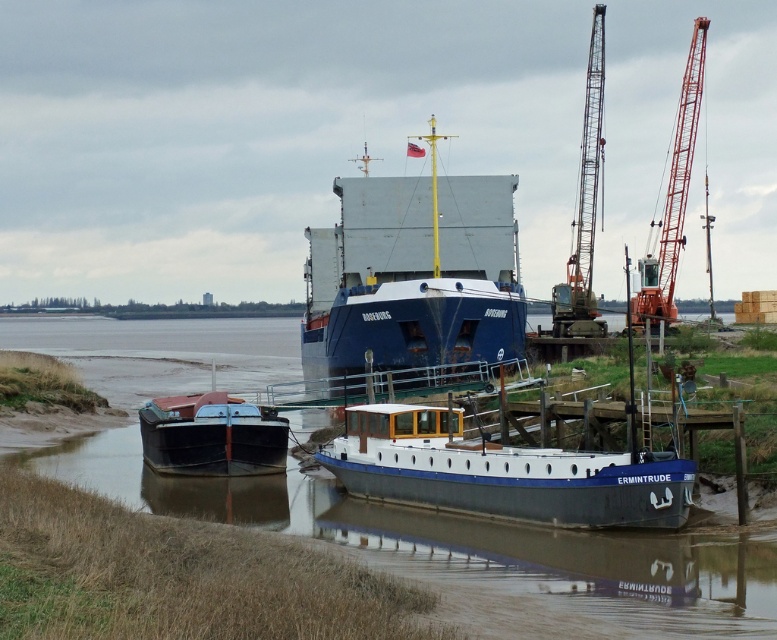
Question: Which object appears closest to the camera in this image?

Choices:
 (A) matte black boat at lower left
 (B) white glossy boat at center
 (C) metallic gray crane at upper right
 (D) blue matte cargo ship at center

Answer: (B)

Question: Is blue matte cargo ship at center below orange metallic crane at upper right?

Choices:
 (A) no
 (B) yes

Answer: (B)

Question: Is white glossy boat at center behind matte black boat at lower left?

Choices:
 (A) yes
 (B) no

Answer: (B)

Question: Which point appears farthest from the camera in this image?

Choices:
 (A) (364, 236)
 (B) (577, 292)
 (C) (431, 461)
 (D) (507, 582)

Answer: (B)

Question: Is smooth mud at boat center to the left of white glossy boat at center from the viewer's perspective?

Choices:
 (A) yes
 (B) no

Answer: (A)

Question: Which of the following is the closest to the observer?

Choices:
 (A) blue matte cargo ship at center
 (B) matte black boat at lower left

Answer: (B)